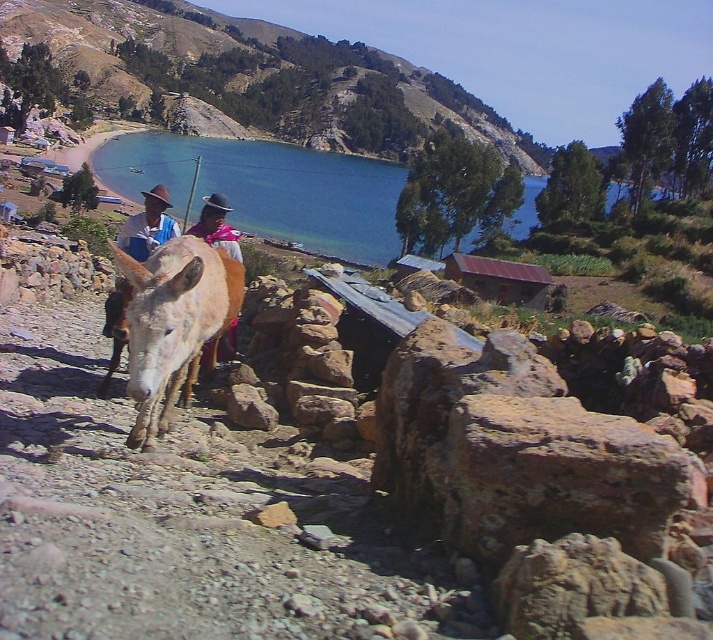
Is blue water at center closer to the viewer compared to light brown fur donkey at center?

No, blue water at center is further to the viewer.

Between point (371, 248) and point (237, 294), which one is positioned in front?

Point (237, 294) is more forward.

Is point (352, 195) positioned behind point (168, 269)?

That is True.

Identify the location of blue water at center. This screenshot has height=640, width=713. (267, 188).

Can you confirm if green grassy hillside at upper center is wider than blue water at center?

Correct, the width of green grassy hillside at upper center exceeds that of blue water at center.

Is green grassy hillside at upper center smaller than blue water at center?

No.

Between point (478, 128) and point (389, 188), which one is positioned in front?

Point (389, 188)

This screenshot has height=640, width=713. In order to click on green grassy hillside at upper center in this screenshot , I will do `click(255, 77)`.

The height and width of the screenshot is (640, 713). What do you see at coordinates (255, 77) in the screenshot? I see `green grassy hillside at upper center` at bounding box center [255, 77].

Does green grassy hillside at upper center appear under light brown fur donkey at center?

Incorrect, green grassy hillside at upper center is not positioned below light brown fur donkey at center.

Who is more distant from viewer, (324, 131) or (143, 324)?

Positioned behind is point (324, 131).

You are a GUI agent. You are given a task and a screenshot of the screen. Output one action in this format:
    pyautogui.click(x=<x>, y=<y>)
    Task: Click on the green grassy hillside at upper center
    The image size is (713, 640).
    Given the screenshot: What is the action you would take?
    pyautogui.click(x=255, y=77)